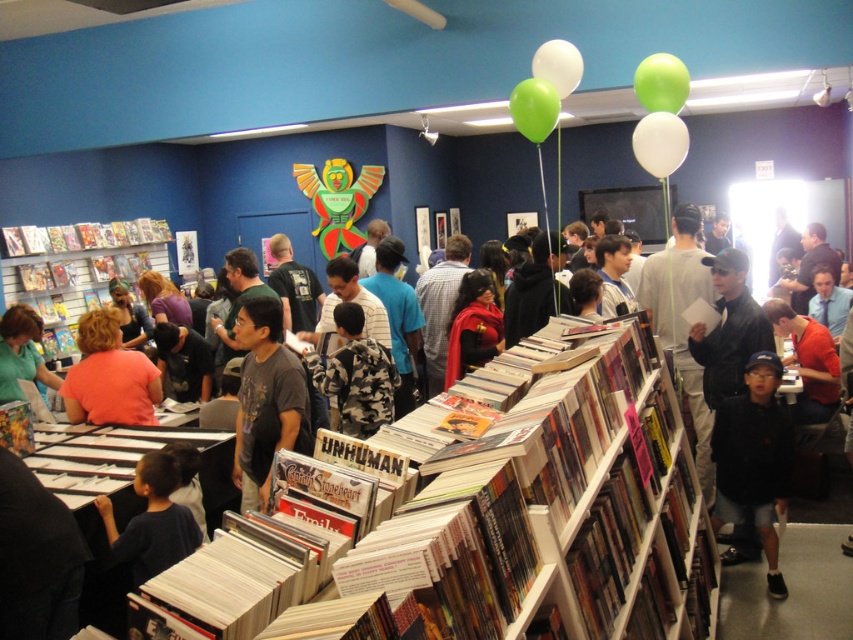
Question: Is green rubber balloon at upper center smaller than white rubber balloon at upper center?

Choices:
 (A) no
 (B) yes

Answer: (A)

Question: Can you confirm if black cotton shirt at center is wider than matte green shirt at left?

Choices:
 (A) no
 (B) yes

Answer: (B)

Question: Which point is farther from the camera taking this photo?

Choices:
 (A) [50, 241]
 (B) [62, 262]
 (C) [645, 163]

Answer: (B)

Question: Which object appears farthest from the camera in this image?

Choices:
 (A) hardcover books at center
 (B) matte cardboard bookshelf at left
 (C) white glossy comic books at upper left
 (D) green rubber balloon at upper right

Answer: (C)

Question: Does black cotton shirt at center come in front of white glossy comic books at upper left?

Choices:
 (A) yes
 (B) no

Answer: (A)

Question: Which of the following is the closest to the observer?

Choices:
 (A) (109, 408)
 (B) (657, 65)

Answer: (B)